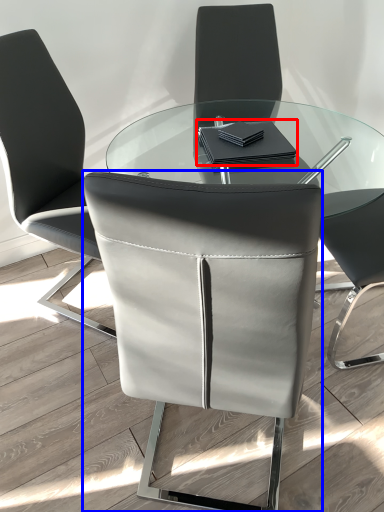
Question: Which of the following is the farthest to the observer, notebook (highlighted by a red box) or chair (highlighted by a blue box)?

Choices:
 (A) notebook
 (B) chair

Answer: (A)